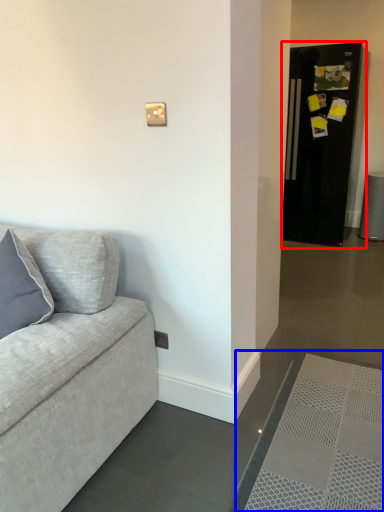
Question: Among these objects, which one is farthest to the camera, fridge (highlighted by a red box) or doormat (highlighted by a blue box)?

Choices:
 (A) fridge
 (B) doormat

Answer: (A)